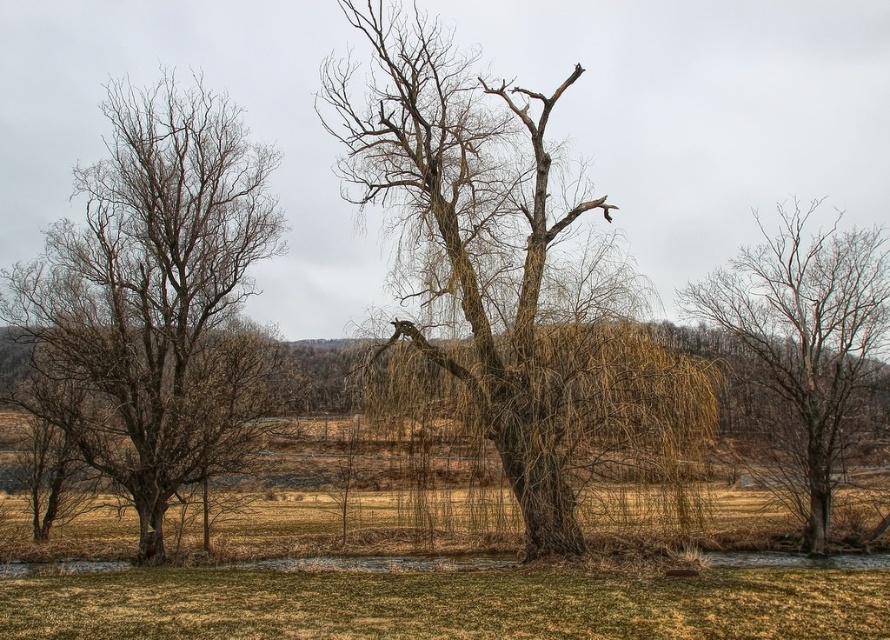
Question: Does bare branches at left appear under brown dry grass at lower center?

Choices:
 (A) no
 (B) yes

Answer: (A)

Question: Which object appears closest to the camera in this image?

Choices:
 (A) bare branches at center
 (B) bare branches at left

Answer: (B)

Question: Is bare branches at left positioned behind bare branches at center?

Choices:
 (A) no
 (B) yes

Answer: (A)

Question: Which object is closer to the camera taking this photo?

Choices:
 (A) bare branches at center
 (B) bare branches at left
 (C) brown textured tree at center
 (D) brown dry grass at lower center

Answer: (D)

Question: Where is bare branches at left located in relation to brown dry grass at lower center in the image?

Choices:
 (A) above
 (B) below

Answer: (A)

Question: Among these objects, which one is farthest from the camera?

Choices:
 (A) brown dry grass at lower center
 (B) brown textured tree at center

Answer: (B)